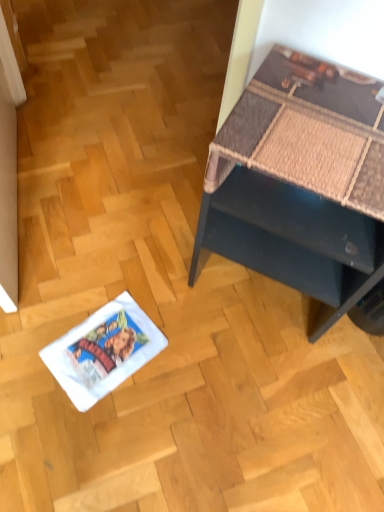
The width and height of the screenshot is (384, 512). I want to click on vacant space in front of dark blue textured desk at upper right, so click(260, 409).